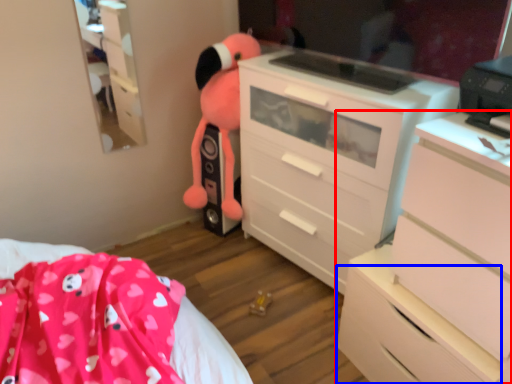
Question: Among these objects, which one is farthest to the camera, chest of drawers (highlighted by a red box) or drawer (highlighted by a blue box)?

Choices:
 (A) chest of drawers
 (B) drawer

Answer: (B)